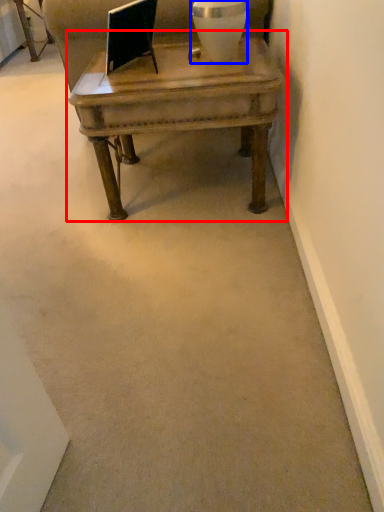
Question: Among these objects, which one is nearest to the camera, coffee table (highlighted by a red box) or vase (highlighted by a blue box)?

Choices:
 (A) coffee table
 (B) vase

Answer: (A)